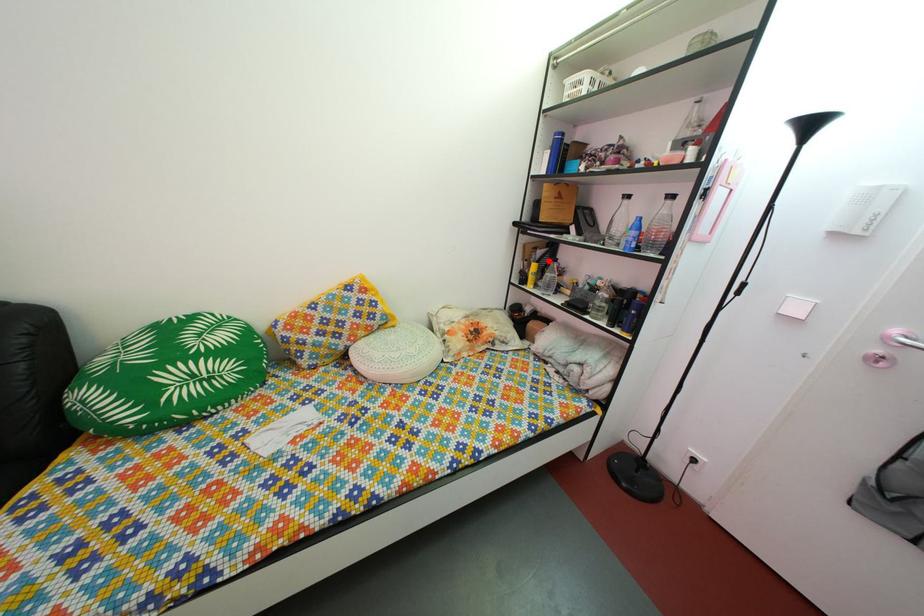
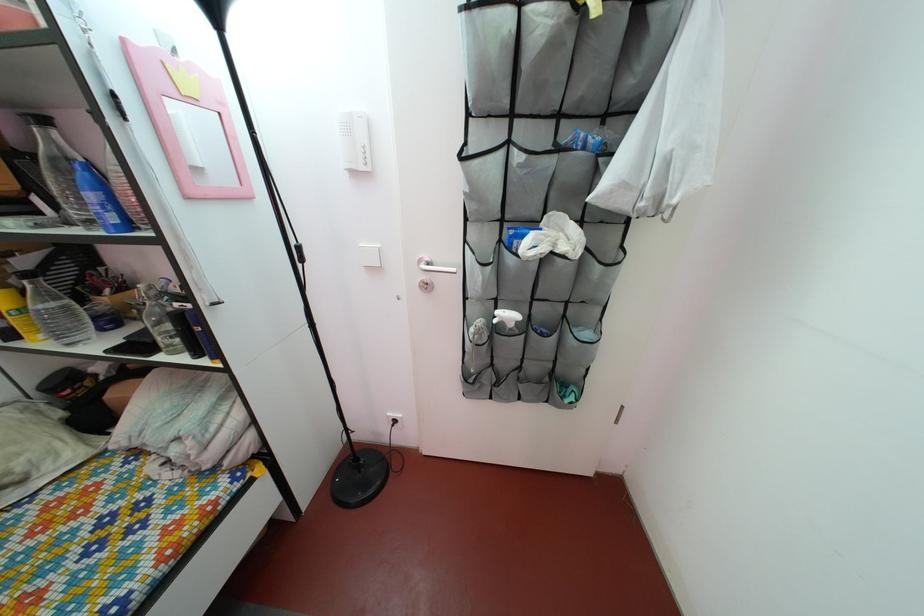
Question: I am providing you with two images of the same scene from different viewpoints. A red point is marked on the first image. Can you still see the location of the red point in image 2?

Choices:
 (A) Yes
 (B) No

Answer: (A)